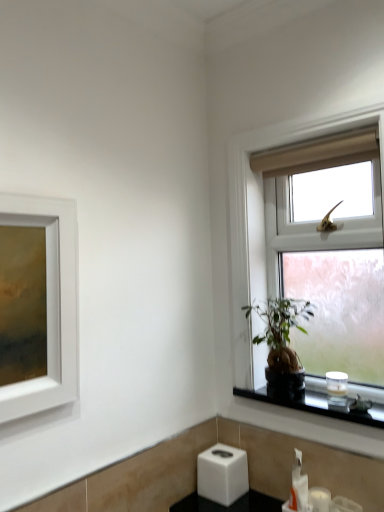
Question: In terms of width, does green leafy plant at window look wider or thinner when compared to clear glass window at upper right?

Choices:
 (A) wide
 (B) thin

Answer: (B)

Question: Based on their sizes in the image, would you say green leafy plant at window is bigger or smaller than clear glass window at upper right?

Choices:
 (A) big
 (B) small

Answer: (B)

Question: Which object is positioned farthest from the clear glass window at upper right?

Choices:
 (A) green leafy plant at window
 (B) white plastic soap dispenser at lower right
 (C) black glass candle at right

Answer: (B)

Question: Which object is the farthest from the white plastic soap dispenser at lower right?

Choices:
 (A) clear glass window at upper right
 (B) green leafy plant at window
 (C) black glass candle at right

Answer: (A)